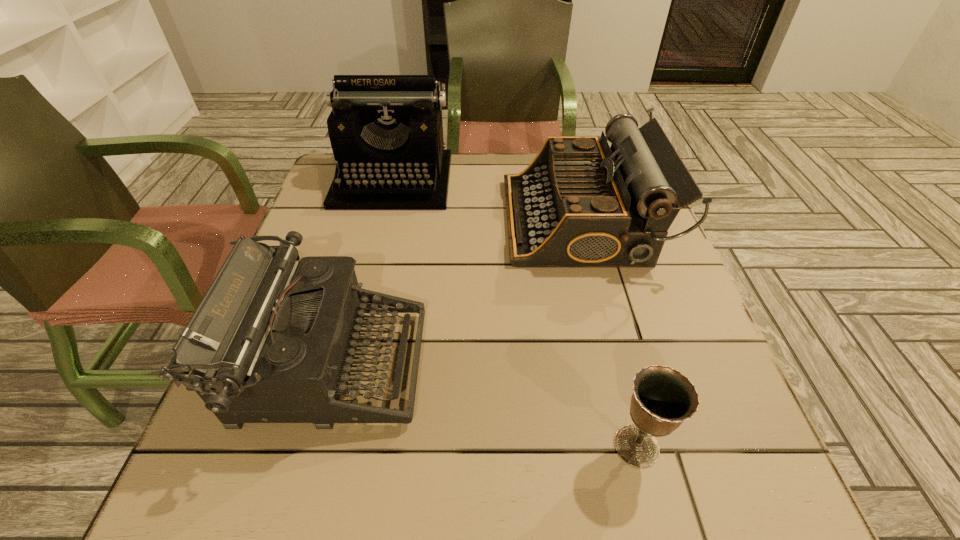
Find the location of a particular element. This screenshot has width=960, height=540. free spot between the shortest object and the tallest typewriter is located at coordinates (515, 313).

This screenshot has width=960, height=540. What are the coordinates of `free spot between the rightmost typewriter and the shortest object` in the screenshot? It's located at (609, 333).

Find the location of `free area in between the nearest typewriter and the tallest object`. free area in between the nearest typewriter and the tallest object is located at coordinates (361, 273).

This screenshot has width=960, height=540. What are the coordinates of `blank region between the nearest typewriter and the chalice` in the screenshot? It's located at (483, 406).

You are a GUI agent. You are given a task and a screenshot of the screen. Output one action in this format:
    pyautogui.click(x=<x>, y=<y>)
    Task: Click on the free spot between the shortest object and the tallest object
    The height and width of the screenshot is (540, 960).
    Given the screenshot: What is the action you would take?
    pyautogui.click(x=515, y=313)

Identify the location of object identified as the closest to the rightmost typewriter. (386, 132).

This screenshot has width=960, height=540. Identify the location of object that stands as the closest to the chalice. (271, 341).

This screenshot has height=540, width=960. I want to click on typewriter that is the second nearest to the rightmost typewriter, so click(x=271, y=341).

Identify which typewriter is the second closest to the shortest object. Please provide its 2D coordinates. Your answer should be formatted as a tuple, i.e. [(x, y)], where the tuple contains the x and y coordinates of a point satisfying the conditions above.

[(580, 204)]

Where is `vacant space that satisfies the following two spatial constraints: 1. on the typing side of the tallest object; 2. on the left side of the shortest object`? vacant space that satisfies the following two spatial constraints: 1. on the typing side of the tallest object; 2. on the left side of the shortest object is located at coordinates 326,446.